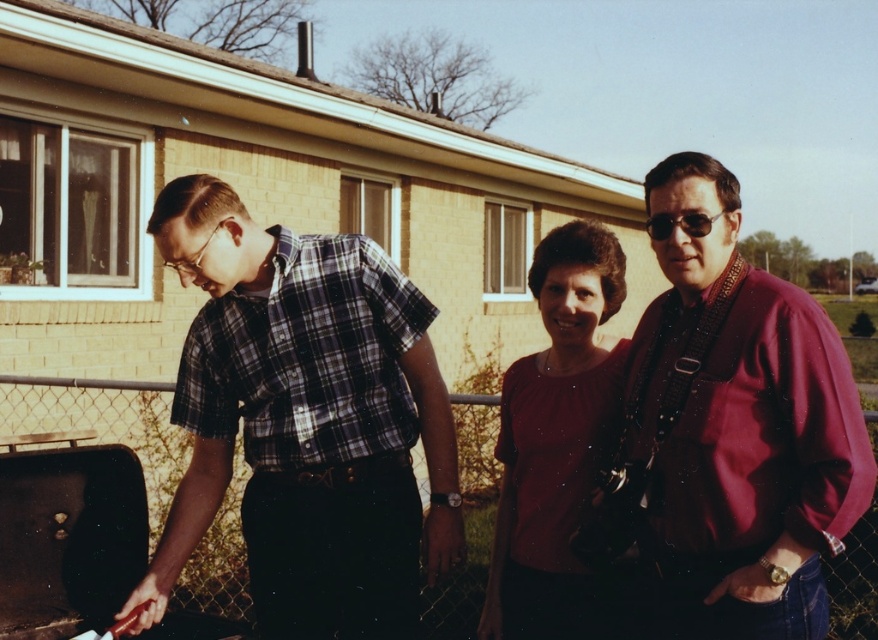
You are a photographer trying to capture a group photo of the maroon fabric shirt at right and the matte red blouse at center. Which person should you position closer to the camera to ensure both appear equally tall in the photo?

The maroon fabric shirt at right has a lesser height compared to matte red blouse at center, so you should position the maroon fabric shirt at right closer to the camera to make them appear the same height in the photo.

You are standing in front of the brick building and want to locate the maroon fabric shirt at right. Which direction should you look to find it?

The maroon fabric shirt at right is located at point [738,429], so you should look to the right side of the scene to find it.